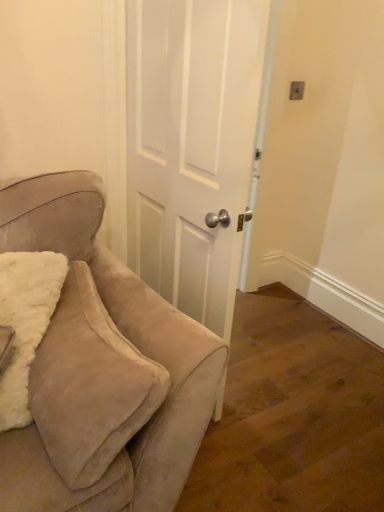
Question: Is white matte door at center inside the boundaries of suede beige chair at left, or outside?

Choices:
 (A) outside
 (B) inside

Answer: (A)

Question: From the image's perspective, is white matte door at center positioned above or below suede beige chair at left?

Choices:
 (A) below
 (B) above

Answer: (B)

Question: From a real-world perspective, relative to suede beige chair at left, is white matte door at center vertically above or below?

Choices:
 (A) below
 (B) above

Answer: (B)

Question: Considering their positions, is suede beige chair at left located in front of or behind white matte door at center?

Choices:
 (A) behind
 (B) front

Answer: (B)

Question: Would you say suede beige chair at left is to the left or to the right of white matte door at center in the picture?

Choices:
 (A) left
 (B) right

Answer: (A)

Question: Is point (114, 431) positioned closer to the camera than point (210, 173)?

Choices:
 (A) closer
 (B) farther

Answer: (A)

Question: In terms of size, does suede beige chair at left appear bigger or smaller than white matte door at center?

Choices:
 (A) small
 (B) big

Answer: (A)